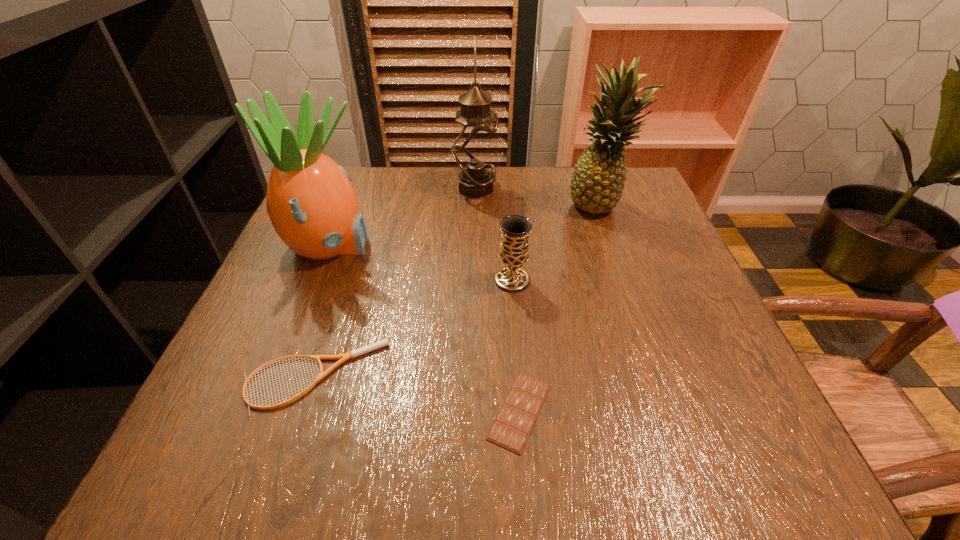
The image size is (960, 540). Find the location of `free spot that satisfies the following two spatial constraints: 1. at the entrance of the fourth tallest object; 2. on the left side of the left pineapple`. free spot that satisfies the following two spatial constraints: 1. at the entrance of the fourth tallest object; 2. on the left side of the left pineapple is located at coordinates pos(316,280).

Where is `vacant space that satisfies the following two spatial constraints: 1. on the front side of the chocolate bar; 2. on the left side of the fifth tallest object`? This screenshot has width=960, height=540. vacant space that satisfies the following two spatial constraints: 1. on the front side of the chocolate bar; 2. on the left side of the fifth tallest object is located at coordinates (303, 411).

The height and width of the screenshot is (540, 960). I want to click on blank space that satisfies the following two spatial constraints: 1. at the entrance of the left pineapple; 2. on the right side of the third shortest object, so [316, 280].